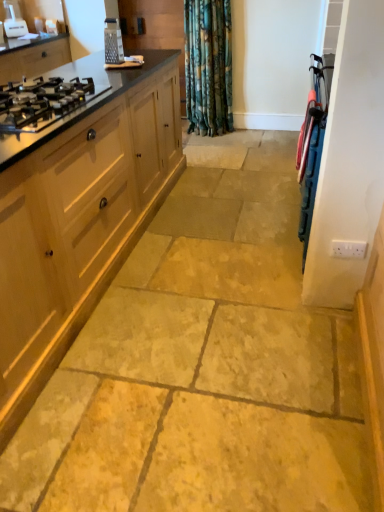
Question: Can you confirm if matte wood stove at upper left, positioned as the 2th cabinetry in bottom-to-top order, is bigger than black glass gas stove at left?

Choices:
 (A) no
 (B) yes

Answer: (B)

Question: Can you confirm if matte wood stove at upper left, positioned as the 2th cabinetry in bottom-to-top order, is shorter than black glass gas stove at left?

Choices:
 (A) yes
 (B) no

Answer: (B)

Question: Does matte wood stove at upper left, positioned as the 2th cabinetry in bottom-to-top order, have a smaller size compared to black glass gas stove at left?

Choices:
 (A) yes
 (B) no

Answer: (B)

Question: Is the depth of matte wood stove at upper left, which is counted as the first cabinetry, starting from the left, less than that of black glass gas stove at left?

Choices:
 (A) yes
 (B) no

Answer: (B)

Question: Would you consider matte wood stove at upper left, the 2th cabinetry positioned from the front, to be distant from black glass gas stove at left?

Choices:
 (A) no
 (B) yes

Answer: (B)

Question: In the image, is white plastic appliance at upper left, which appears as the 2th appliance when ordered from the bottom, positioned in front of or behind black glass gas stove at left?

Choices:
 (A) front
 (B) behind

Answer: (B)

Question: From a real-world perspective, is white plastic appliance at upper left, which is the first appliance from top to bottom, positioned above or below black glass gas stove at left?

Choices:
 (A) above
 (B) below

Answer: (A)

Question: In terms of size, does white plastic appliance at upper left, the 1th appliance positioned from the left, appear bigger or smaller than black glass gas stove at left?

Choices:
 (A) small
 (B) big

Answer: (A)

Question: From the image's perspective, is white plastic appliance at upper left, the first appliance when ordered from back to front, above or below black glass gas stove at left?

Choices:
 (A) below
 (B) above

Answer: (B)

Question: Considering the positions of point (79, 211) and point (340, 118), is point (79, 211) closer or farther from the camera than point (340, 118)?

Choices:
 (A) closer
 (B) farther

Answer: (B)

Question: Choose the correct answer: Is light wood cabinet at left, positioned as the 2th cabinetry in back-to-front order, inside blue plastic screen door at right or outside it?

Choices:
 (A) inside
 (B) outside

Answer: (B)

Question: Considering the relative positions of light wood cabinet at left, which ranks as the second cabinetry in left-to-right order, and blue plastic screen door at right in the image provided, is light wood cabinet at left, which ranks as the second cabinetry in left-to-right order, to the left or to the right of blue plastic screen door at right?

Choices:
 (A) right
 (B) left

Answer: (B)

Question: Looking at their shapes, would you say light wood cabinet at left, which ranks as the second cabinetry in left-to-right order, is wider or thinner than blue plastic screen door at right?

Choices:
 (A) thin
 (B) wide

Answer: (B)

Question: In terms of size, does metallic grater at upper left, which appears as the second appliance when viewed from the top, appear bigger or smaller than light wood cabinet at left, which is the first cabinetry from bottom to top?

Choices:
 (A) big
 (B) small

Answer: (B)

Question: Considering the positions of point (107, 59) and point (1, 274), is point (107, 59) closer or farther from the camera than point (1, 274)?

Choices:
 (A) closer
 (B) farther

Answer: (B)